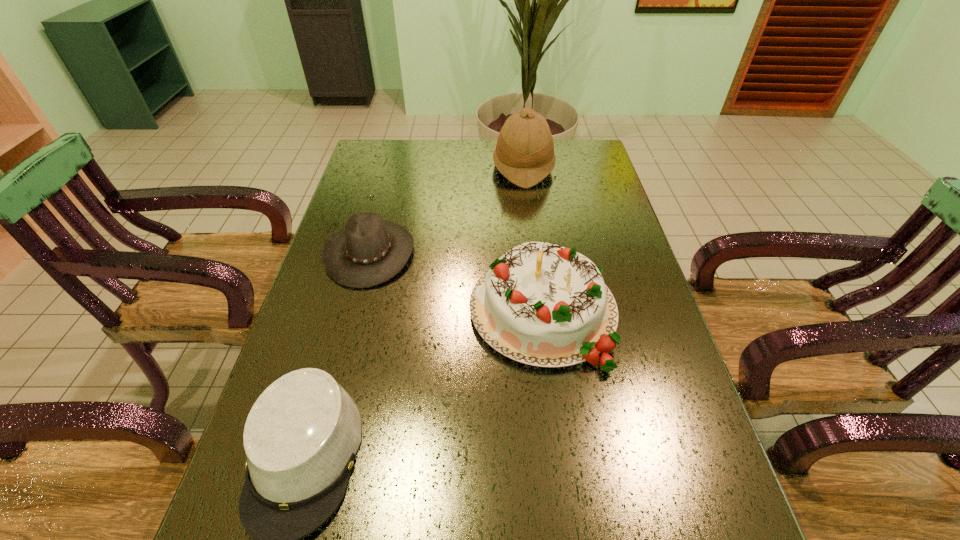
Locate an element on the screen. The height and width of the screenshot is (540, 960). free spot between the cake and the second nearest hat is located at coordinates (456, 282).

Identify the location of free space between the second nearest hat and the cake. Image resolution: width=960 pixels, height=540 pixels. 456,282.

Where is `empty space that is in between the second nearest hat and the tallest hat`? The height and width of the screenshot is (540, 960). empty space that is in between the second nearest hat and the tallest hat is located at coordinates (446, 210).

Find the location of a particular element. The width and height of the screenshot is (960, 540). object that stands as the second closest to the nearest hat is located at coordinates (368, 251).

Select which object is the closest to the cake. Please provide its 2D coordinates. Your answer should be formatted as a tuple, i.e. [(x, y)], where the tuple contains the x and y coordinates of a point satisfying the conditions above.

[(368, 251)]

Find the location of a particular element. hat that can be found as the second closest to the second farthest hat is located at coordinates (524, 154).

What are the coordinates of `hat identified as the closest to the second nearest hat` in the screenshot? It's located at (301, 436).

Where is `vacant area in the image that satisfies the following two spatial constraints: 1. on the front-facing side of the tallest hat; 2. on the back side of the cake`? This screenshot has height=540, width=960. vacant area in the image that satisfies the following two spatial constraints: 1. on the front-facing side of the tallest hat; 2. on the back side of the cake is located at coordinates (541, 312).

Identify the location of free space that satisfies the following two spatial constraints: 1. on the front-facing side of the cake; 2. on the right side of the second farthest hat. The image size is (960, 540). (354, 312).

This screenshot has width=960, height=540. What are the coordinates of `free space that satisfies the following two spatial constraints: 1. on the front-facing side of the farthest hat; 2. on the left side of the cake` in the screenshot? It's located at (541, 312).